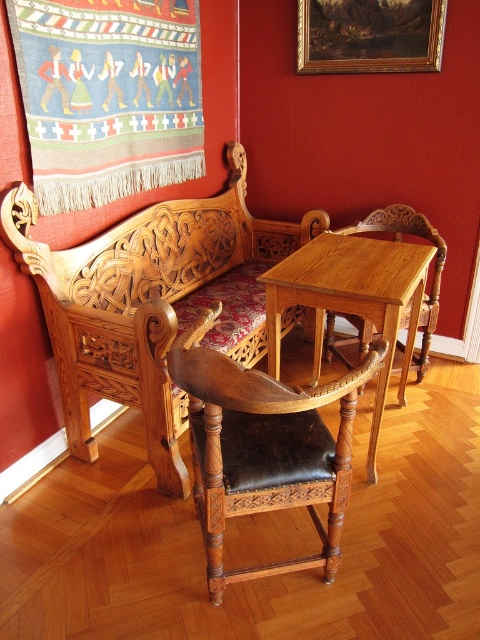
You are sitting on the wooden armchair at center and want to admire the knitted wool tapestry at upper left. Which direction should you turn your head to look at it?

Since the knitted wool tapestry at upper left is closer to the viewer than the wooden armchair at center, you would need to turn your head upward to look at the knitted wool tapestry at upper left.